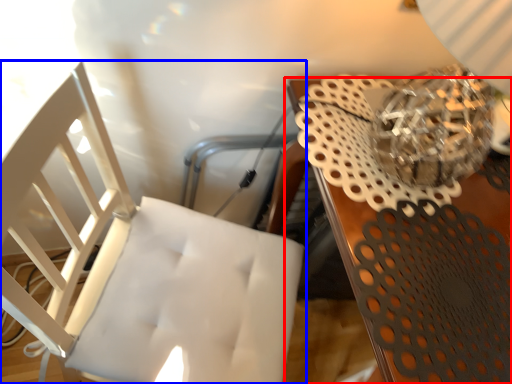
Question: Which object is closer to the camera taking this photo, table (highlighted by a red box) or chair (highlighted by a blue box)?

Choices:
 (A) table
 (B) chair

Answer: (B)